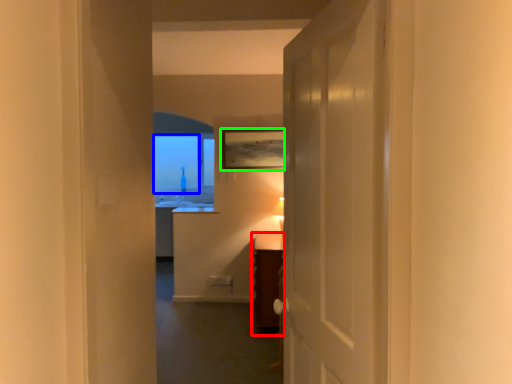
Question: Which is farther away from vanity (highlighted by a red box)? window screen (highlighted by a blue box) or picture frame (highlighted by a green box)?

Choices:
 (A) window screen
 (B) picture frame

Answer: (A)